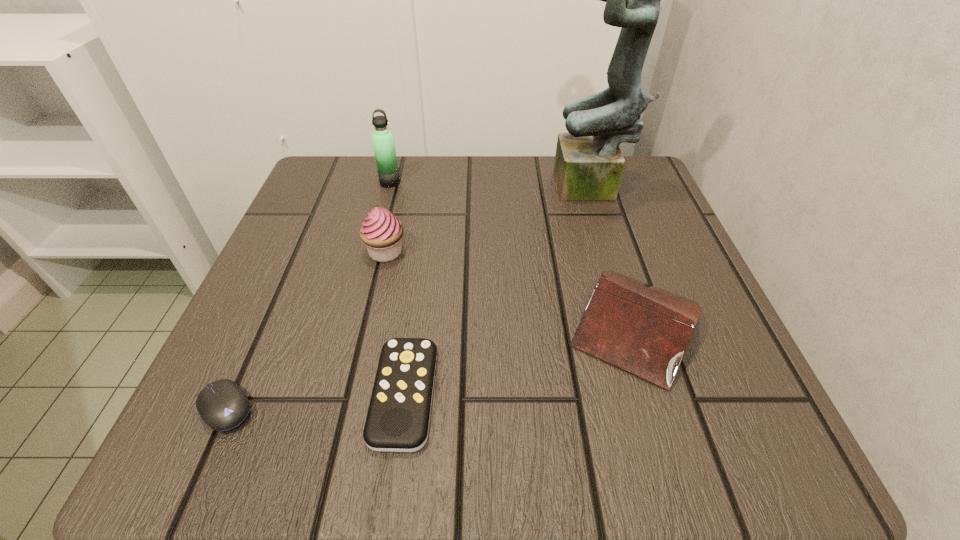
Where is `sculpture`? The width and height of the screenshot is (960, 540). sculpture is located at coordinates (589, 164).

Locate an element on the screen. This screenshot has width=960, height=540. the fifth shortest object is located at coordinates coord(383,141).

Locate an element on the screen. This screenshot has width=960, height=540. the fourth shortest object is located at coordinates (381, 232).

I want to click on cupcake, so click(x=381, y=232).

Where is `book`? book is located at coordinates (645, 330).

Where is `computer mouse`? computer mouse is located at coordinates (223, 405).

At what (x,y) coordinates should I click in order to perform the action: click on remote control. Please return your answer as a coordinate pair (x, y). This screenshot has width=960, height=540. Looking at the image, I should click on (398, 418).

Identify the location of free space located 0.250m on the face of the tallest object. (436, 190).

Image resolution: width=960 pixels, height=540 pixels. I want to click on vacant space located on the face of the tallest object, so click(x=441, y=190).

At what (x,y) coordinates should I click in order to perform the action: click on blank space located 0.060m on the face of the tallest object. Please return your answer as a coordinate pair (x, y). Looking at the image, I should click on (526, 190).